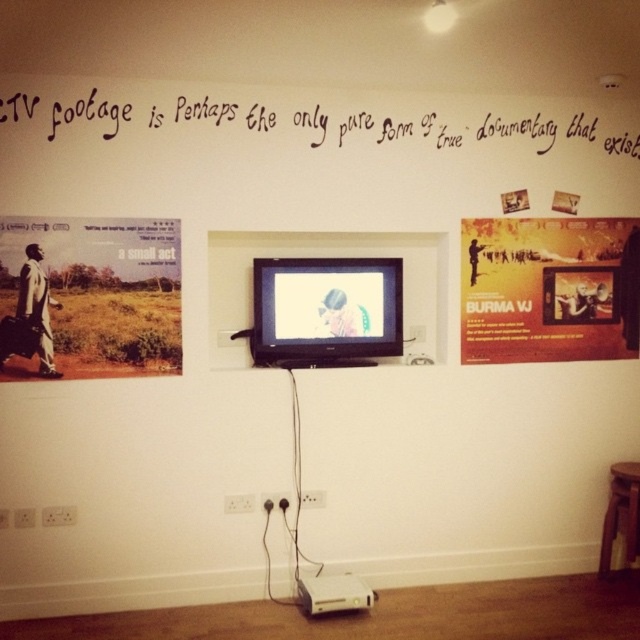
Question: Which object is closer to the camera taking this photo?

Choices:
 (A) brown wooden stool at lower right
 (B) black calligraphy at upper center
 (C) matte cardboard poster at left
 (D) matte black flat screen tv at center

Answer: (B)

Question: Can you confirm if matte cardboard poster at left is positioned above matte black flat screen tv at center?

Choices:
 (A) yes
 (B) no

Answer: (A)

Question: Which point is closer to the camera?

Choices:
 (A) (472, 138)
 (B) (608, 516)

Answer: (A)

Question: Estimate the real-world distances between objects in this image. Which object is closer to the matte cardboard poster at left?

Choices:
 (A) yellow paper poster at upper right
 (B) black calligraphy at upper center
 (C) matte black flat screen tv at center
 (D) brown wooden stool at lower right

Answer: (B)

Question: Is yellow paper poster at upper right positioned in front of matte black flat screen tv at center?

Choices:
 (A) no
 (B) yes

Answer: (A)

Question: Does yellow paper poster at upper right come in front of black calligraphy at upper center?

Choices:
 (A) yes
 (B) no

Answer: (B)